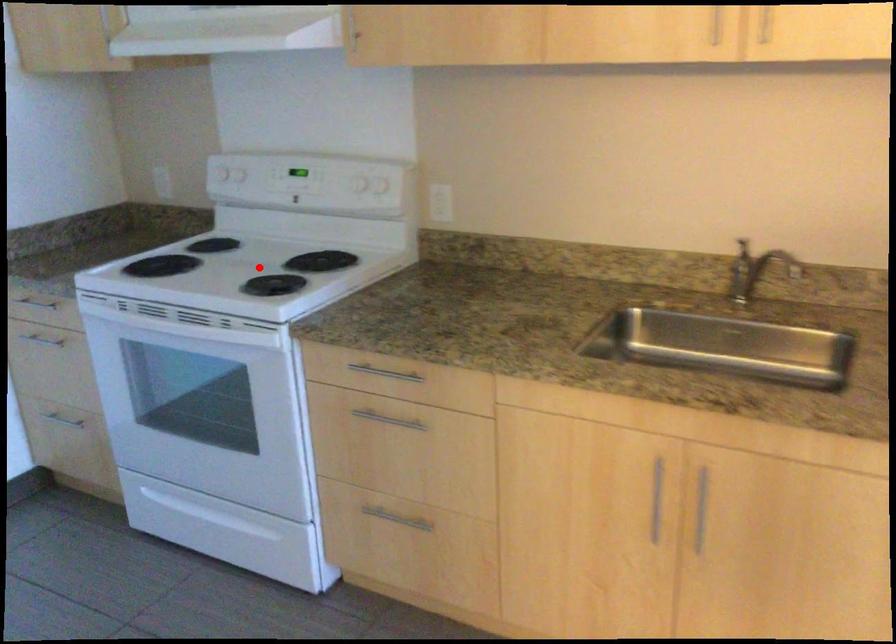
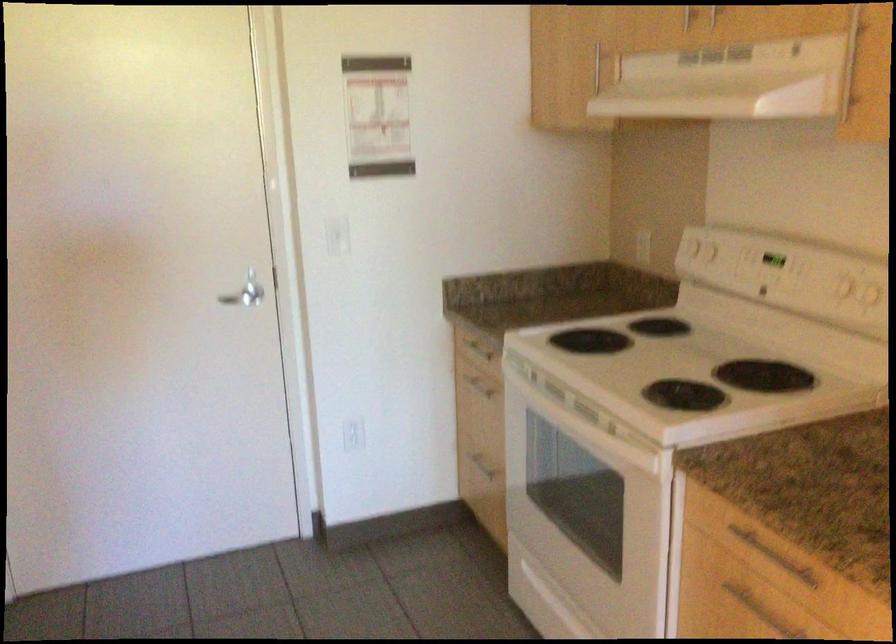
Question: A red point is marked in image1. In image2, is the corresponding 3D point closer to the camera or farther? Reply with the corresponding letter.

Choices:
 (A) The corresponding 3D point is closer.
 (B) The corresponding 3D point is farther.

Answer: (A)